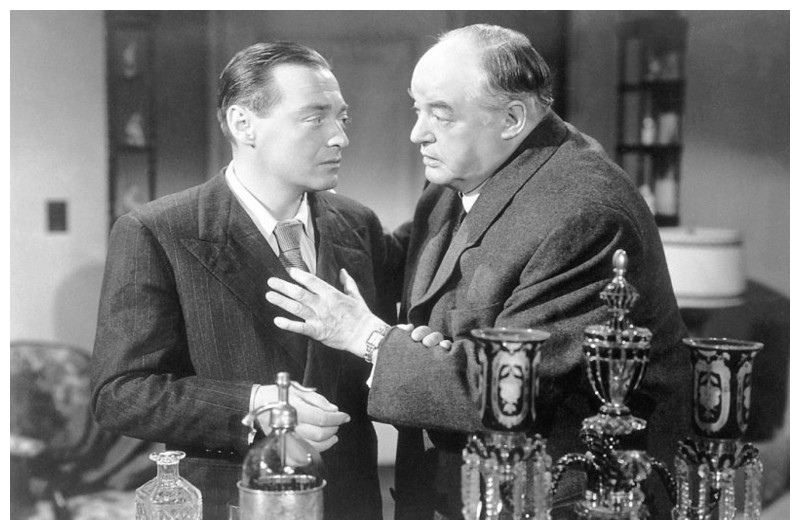
Identify the location of lampshade. Image resolution: width=800 pixels, height=530 pixels. (694, 269).